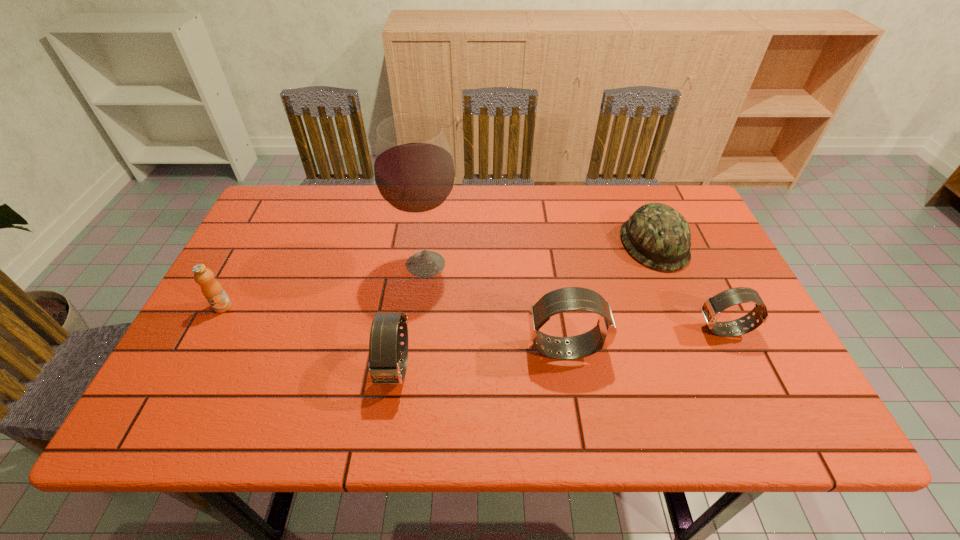
At what (x,y) coordinates should I click in order to perform the action: click on free space located on the face of the shortest watch. Please return your answer as a coordinate pair (x, y). Looking at the image, I should click on (616, 330).

This screenshot has height=540, width=960. I want to click on vacant area situated on the front label of the leftmost object, so click(204, 344).

This screenshot has width=960, height=540. I want to click on vacant space situated 0.070m on the back of the headwear, so [x=638, y=205].

Where is `blank area located 0.400m on the right of the alcohol`? This screenshot has height=540, width=960. blank area located 0.400m on the right of the alcohol is located at coordinates tap(610, 264).

Locate an element on the screen. object positioned at the far edge is located at coordinates (656, 235).

Where is `object that is positioned at the left edge`? This screenshot has height=540, width=960. object that is positioned at the left edge is located at coordinates click(x=212, y=290).

This screenshot has height=540, width=960. Identify the location of watch at the right edge. (712, 307).

This screenshot has width=960, height=540. Find the location of `headwear at the right edge`. headwear at the right edge is located at coordinates (656, 235).

The image size is (960, 540). Find the location of `object that is positioned at the far right corner`. object that is positioned at the far right corner is located at coordinates (656, 235).

Locate an element on the screen. vacant space at the far edge of the desktop is located at coordinates [368, 188].